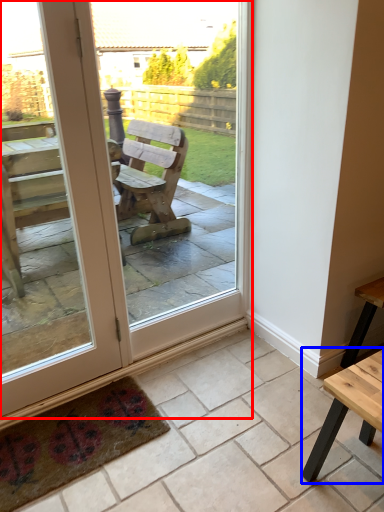
Question: Which point is further to the camera, door (highlighted by a red box) or table (highlighted by a blue box)?

Choices:
 (A) door
 (B) table

Answer: (A)